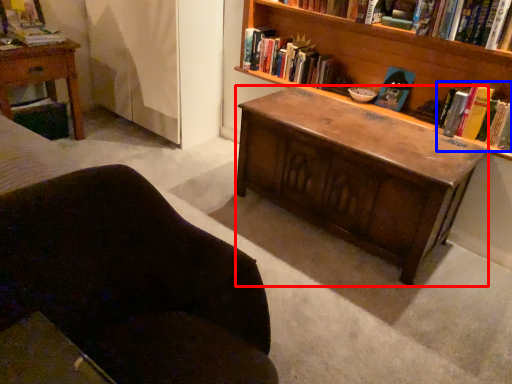
Question: Which point is further to the camera, desk (highlighted by a red box) or book (highlighted by a blue box)?

Choices:
 (A) desk
 (B) book

Answer: (B)